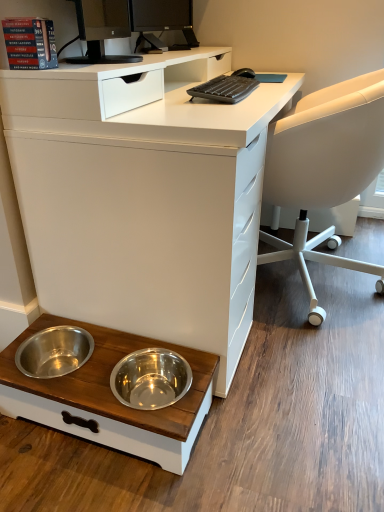
Identify the location of white plastic chair at right. This screenshot has height=512, width=384. (324, 169).

Measure the distance between point (241, 77) and camera.

The distance of point (241, 77) from camera is 5.18 feet.

The height and width of the screenshot is (512, 384). Describe the element at coordinates (225, 89) in the screenshot. I see `black plastic keyboard at upper center` at that location.

Where is `white matte desk at lower left`? The height and width of the screenshot is (512, 384). white matte desk at lower left is located at coordinates coord(143,196).

Locate an element on the screen. The height and width of the screenshot is (512, 384). white plastic chair at right is located at coordinates (324, 169).

This screenshot has width=384, height=512. What are the coordinates of `table located underneath the white matte desk at lower left (from a real-world perspective)` in the screenshot? It's located at tap(109, 398).

Does wooden pet bowls at lower left have a lesser height compared to white matte desk at lower left?

Indeed, wooden pet bowls at lower left has a lesser height compared to white matte desk at lower left.

Is white matte desk at lower left at the back of wooden pet bowls at lower left?

Yes, white matte desk at lower left is at the back of wooden pet bowls at lower left.

Consider the image. Considering the sizes of objects wooden pet bowls at lower left and white matte desk at lower left in the image provided, who is wider, wooden pet bowls at lower left or white matte desk at lower left?

white matte desk at lower left is wider.

From the image's perspective, is white plastic chair at right above or below white matte desk at lower left?

white plastic chair at right is above white matte desk at lower left.

Between white plastic chair at right and white matte desk at lower left, which one is positioned behind?

white plastic chair at right is further from the camera.

Find the location of a particular element. The width and height of the screenshot is (384, 512). chair on the right side of white matte desk at lower left is located at coordinates (324, 169).

Does white plastic chair at right have a greater height compared to white matte desk at lower left?

No, white plastic chair at right is not taller than white matte desk at lower left.

Is point (233, 95) closer to camera compared to point (293, 149)?

Yes.

Is black plastic keyboard at upper center not close to white plastic chair at right?

No, black plastic keyboard at upper center is not far from white plastic chair at right.

How distant is black plastic keyboard at upper center from white plastic chair at right?

black plastic keyboard at upper center is 10.68 inches away from white plastic chair at right.

Does black plastic keyboard at upper center have a greater height compared to white plastic chair at right?

In fact, black plastic keyboard at upper center may be shorter than white plastic chair at right.

Does black plastic keyboard at upper center have a lesser width compared to black glossy monitor at upper center?

No.

From their relative heights in the image, would you say black plastic keyboard at upper center is taller or shorter than black glossy monitor at upper center?

Clearly, black plastic keyboard at upper center is shorter compared to black glossy monitor at upper center.

From the image's perspective, does black plastic keyboard at upper center appear lower than black glossy monitor at upper center?

Indeed, from the image's perspective, black plastic keyboard at upper center is shown beneath black glossy monitor at upper center.

Is black plastic keyboard at upper center positioned far away from red paper book at upper left?

They are positioned close to each other.

Is black plastic keyboard at upper center positioned with its back to red paper book at upper left?

black plastic keyboard at upper center is not turned away from red paper book at upper left.

Which is in front, point (243, 87) or point (5, 36)?

Point (5, 36)

Is white matte desk at lower left wider or thinner than red paper book at upper left?

white matte desk at lower left is wider than red paper book at upper left.

Which of these two, white matte desk at lower left or red paper book at upper left, stands taller?

Standing taller between the two is white matte desk at lower left.

Is red paper book at upper left completely or partially inside white matte desk at lower left?

That's incorrect, red paper book at upper left is not inside white matte desk at lower left.

From the image's perspective, is white matte desk at lower left positioned above or below red paper book at upper left?

white matte desk at lower left is situated lower than red paper book at upper left in the image.

Is wooden pet bowls at lower left bigger or smaller than black plastic keyboard at upper center?

Considering their sizes, wooden pet bowls at lower left takes up more space than black plastic keyboard at upper center.

Locate an element on the screen. The width and height of the screenshot is (384, 512). computer keyboard on the right side of wooden pet bowls at lower left is located at coordinates (225, 89).

How distant is wooden pet bowls at lower left from black plastic keyboard at upper center?

wooden pet bowls at lower left and black plastic keyboard at upper center are 31.64 inches apart.

Which point is more distant from viewer, (96, 392) or (201, 92)?

The point (201, 92) is farther.

Identify the location of table located underneath the white matte desk at lower left (from a real-world perspective). The height and width of the screenshot is (512, 384). (109, 398).

Image resolution: width=384 pixels, height=512 pixels. I want to click on chair that is above the white matte desk at lower left (from a real-world perspective), so click(x=324, y=169).

When comparing their distances from red paper book at upper left, does white plastic chair at right or black plastic keyboard at upper center seem closer?

black plastic keyboard at upper center is closer to red paper book at upper left.

Looking at the image, which one is located further to black glossy monitor at upper center, red paper book at upper left or white plastic chair at right?

Based on the image, white plastic chair at right appears to be further to black glossy monitor at upper center.

Estimate the real-world distances between objects in this image. Which object is further from wooden pet bowls at lower left, white matte desk at lower left or black plastic keyboard at upper center?

black plastic keyboard at upper center is positioned further to the anchor wooden pet bowls at lower left.

Looking at the image, which one is located closer to wooden pet bowls at lower left, black plastic keyboard at upper center or red paper book at upper left?

The object closer to wooden pet bowls at lower left is red paper book at upper left.

Considering their positions, is red paper book at upper left positioned further to white plastic chair at right than black plastic keyboard at upper center?

red paper book at upper left is further to white plastic chair at right.

In the scene shown: Which object lies nearer to the anchor point wooden pet bowls at lower left, white plastic chair at right or red paper book at upper left?

red paper book at upper left is closer to wooden pet bowls at lower left.

Based on their spatial positions, is white matte desk at lower left or black glossy monitor at upper center closer to wooden pet bowls at lower left?

Among the two, white matte desk at lower left is located nearer to wooden pet bowls at lower left.

Based on their spatial positions, is white plastic chair at right or black plastic keyboard at upper center further from wooden pet bowls at lower left?

black plastic keyboard at upper center is further to wooden pet bowls at lower left.

At what (x,y) coordinates should I click in order to perform the action: click on desk between black plastic keyboard at upper center and wooden pet bowls at lower left in the up-down direction. Please return your answer as a coordinate pair (x, y). Looking at the image, I should click on (143, 196).

Find the location of a particular element. Image resolution: width=384 pixels, height=512 pixels. desktop computer located between red paper book at upper left and white plastic chair at right in the left-right direction is located at coordinates (162, 21).

The image size is (384, 512). Find the location of `computer keyboard between white matte desk at lower left and white plastic chair at right in the horizontal direction`. computer keyboard between white matte desk at lower left and white plastic chair at right in the horizontal direction is located at coordinates (225, 89).

Locate an element on the screen. The height and width of the screenshot is (512, 384). chair between black glossy monitor at upper center and wooden pet bowls at lower left vertically is located at coordinates tap(324, 169).